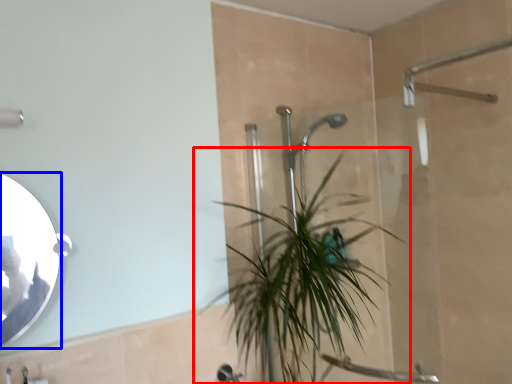
Question: Which object is closer to the camera taking this photo, houseplant (highlighted by a red box) or mirror (highlighted by a blue box)?

Choices:
 (A) houseplant
 (B) mirror

Answer: (B)